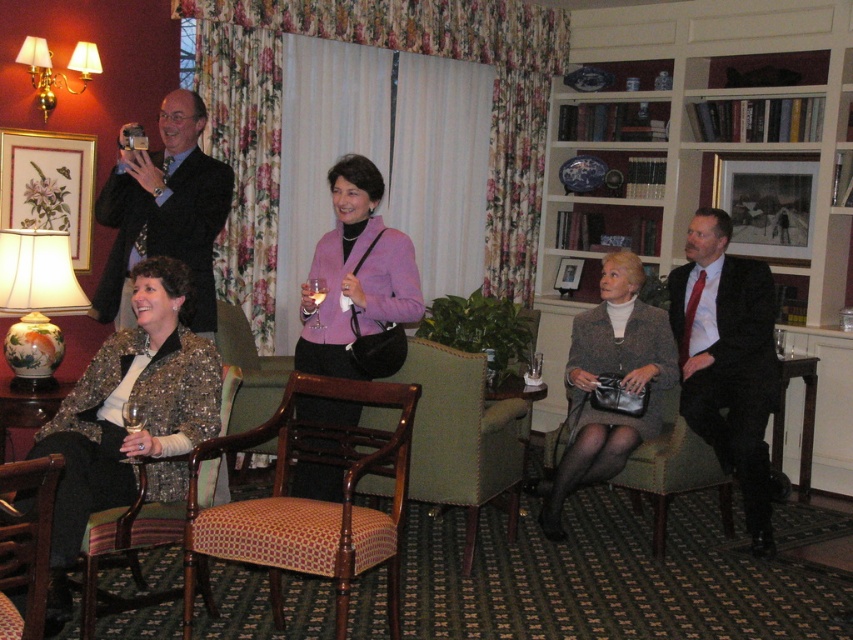
You are standing at the origin point of the room and want to reach the point marked as point (579, 458). There is an obstacle at point (233, 483). Will you have to go around the obstacle to reach your destination?

Yes, you will have to go around the obstacle at point (233, 483) because point (579, 458) is in front of it, meaning the obstacle is blocking the direct path.

You are a photographer at the event. You need to place a 1.2 meter wide banner between the matte black suit at right and the translucent glass wine at lower left. Can the space between them accommodate the banner?

The matte black suit at right is bigger than the translucent glass wine at lower left, but the spatial relationship between their positions isn let us determine the distance between them. Without knowing the actual distance, we cannot confirm if the banner will fit.

You are a photographer at the event and need to capture a photo of the translucent glass wine at lower left without the matte black suit at right appearing in the frame. Is this possible given their positions?

The matte black suit at right is positioned on the right side of the translucent glass wine at lower left, so if you move to the left side of the wine glass, you can frame the shot to exclude the suit.